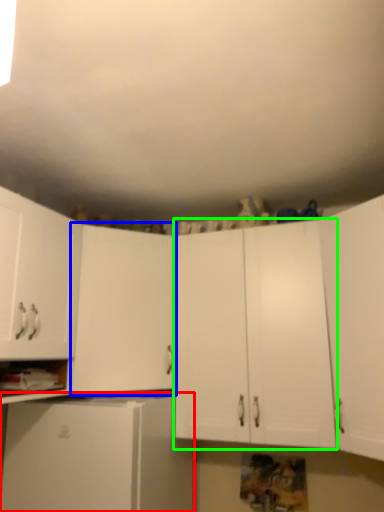
Question: Estimate the real-world distances between objects in this image. Which object is closer to cabinetry (highlighted by a red box), cabinetry (highlighted by a blue box) or cabinetry (highlighted by a green box)?

Choices:
 (A) cabinetry
 (B) cabinetry

Answer: (A)